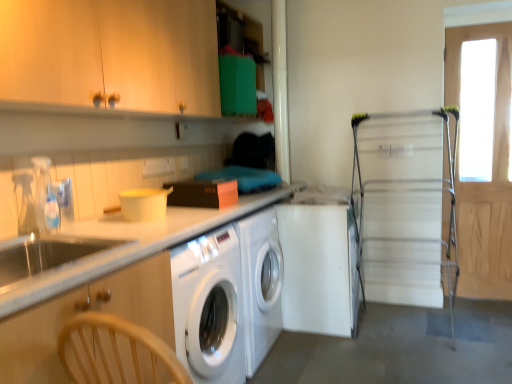
The width and height of the screenshot is (512, 384). In order to click on unoccupied area in front of metallic silver drying rack at right, placed as the 1th screen door when sorted from left to right in this screenshot , I will do tap(424, 364).